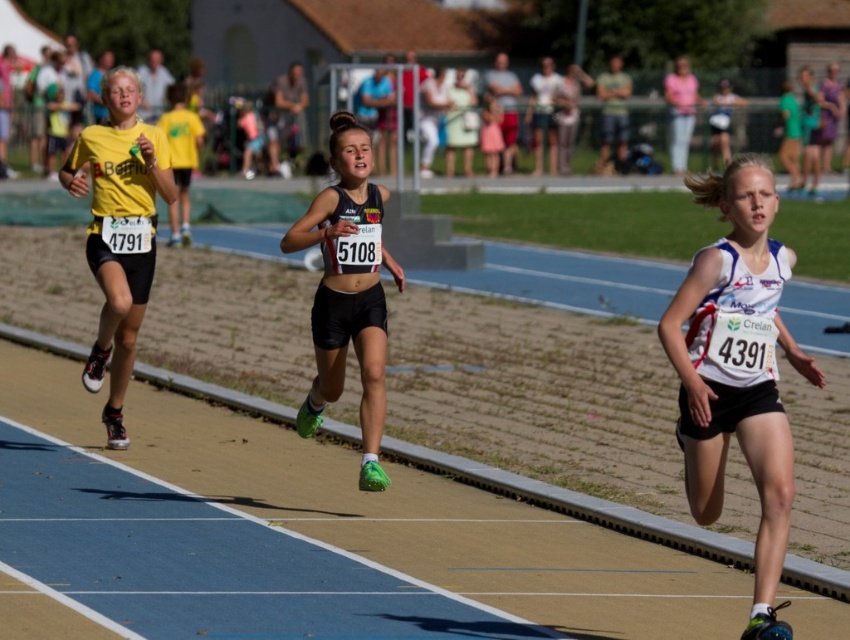
Can you confirm if white fabric tank top at center is positioned above yellow matte running suit at left?

No.

Can you confirm if white fabric tank top at center is positioned to the left of yellow matte running suit at left?

Answer: In fact, white fabric tank top at center is to the right of yellow matte running suit at left.

The width and height of the screenshot is (850, 640). What do you see at coordinates (737, 369) in the screenshot? I see `white fabric tank top at center` at bounding box center [737, 369].

This screenshot has height=640, width=850. What are the coordinates of `white fabric tank top at center` in the screenshot? It's located at (737, 369).

Can you confirm if white fabric tank top at center is positioned to the right of matte black shorts at center?

Indeed, white fabric tank top at center is positioned on the right side of matte black shorts at center.

Based on the photo, is white fabric tank top at center above matte black shorts at center?

No.

What do you see at coordinates (737, 369) in the screenshot? The image size is (850, 640). I see `white fabric tank top at center` at bounding box center [737, 369].

Find the location of `white fabric tank top at center`. white fabric tank top at center is located at coordinates (737, 369).

Consider the image. Which is above, matte black shorts at center or yellow matte running suit at left?

yellow matte running suit at left is higher up.

Is point (367, 332) positioned after point (128, 253)?

No, (367, 332) is closer to viewer.

Where is `matte black shorts at center`? The image size is (850, 640). matte black shorts at center is located at coordinates coord(348,289).